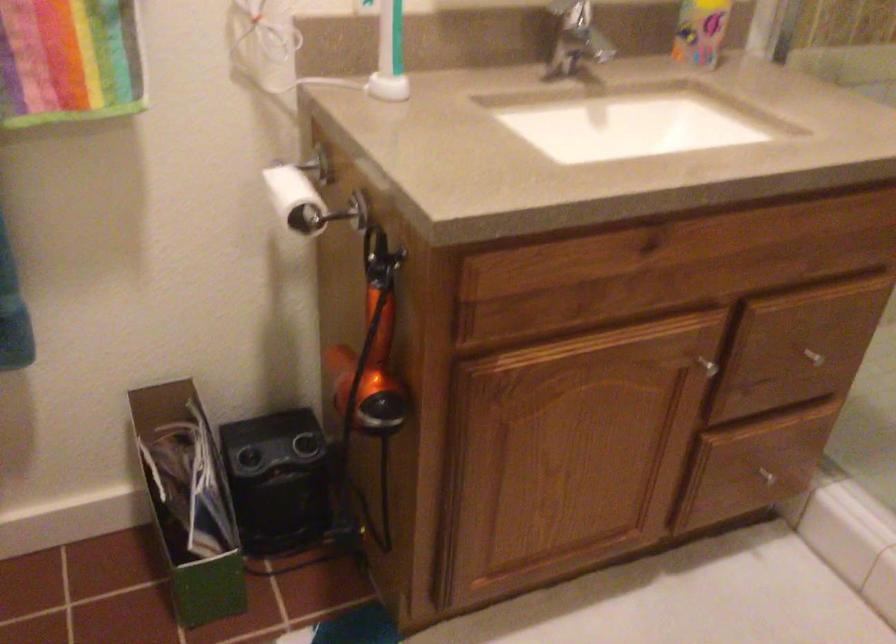
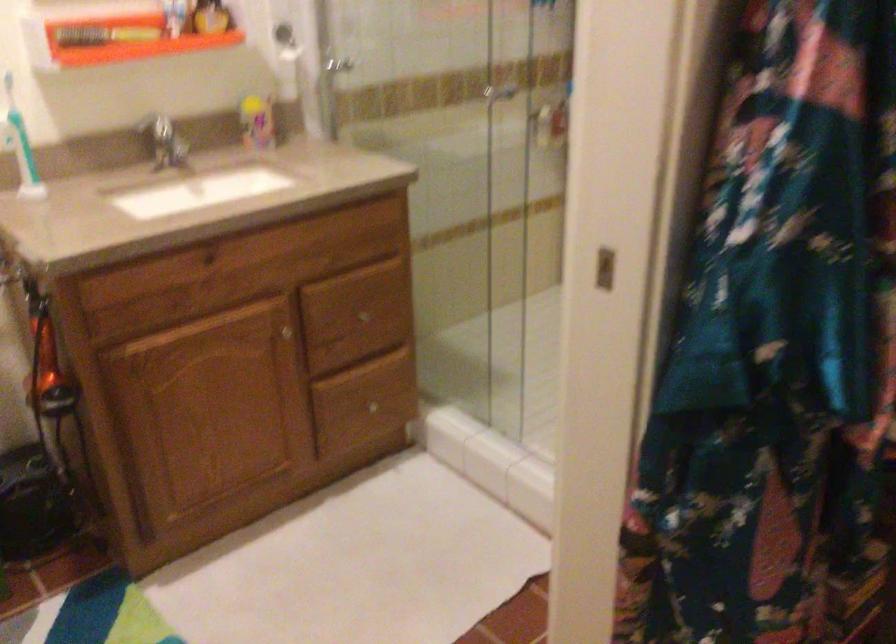
What movement of the cameraman would produce the second image?

The cameraman moved toward right, backward.